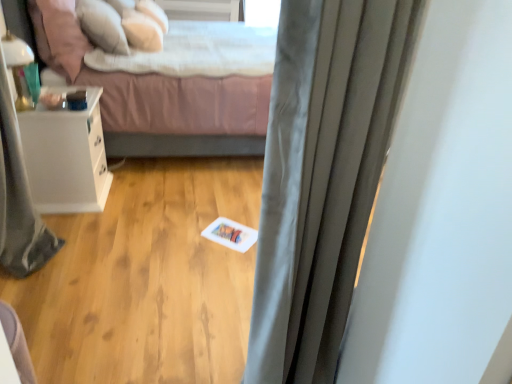
Locate an element on the screen. This screenshot has width=512, height=384. vacant area that lies between gray fabric shower curtain at left and white matte card at center is located at coordinates (138, 247).